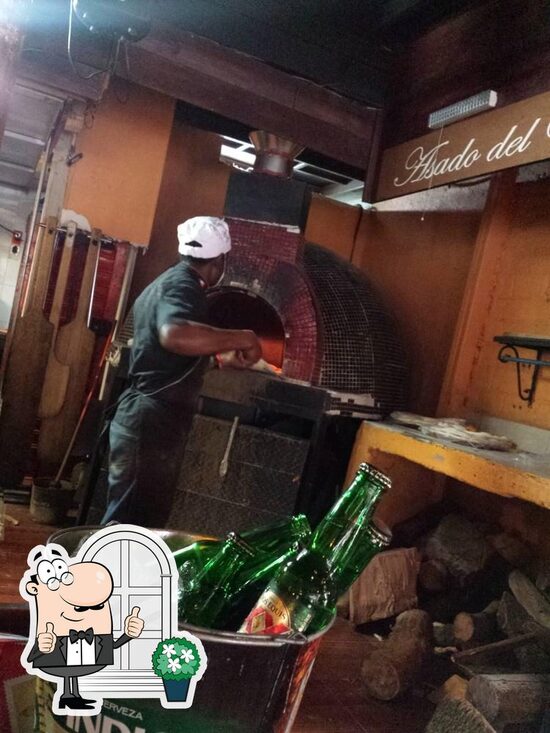
The height and width of the screenshot is (733, 550). What are the coordinates of `1 flower` in the screenshot? It's located at (185, 663).